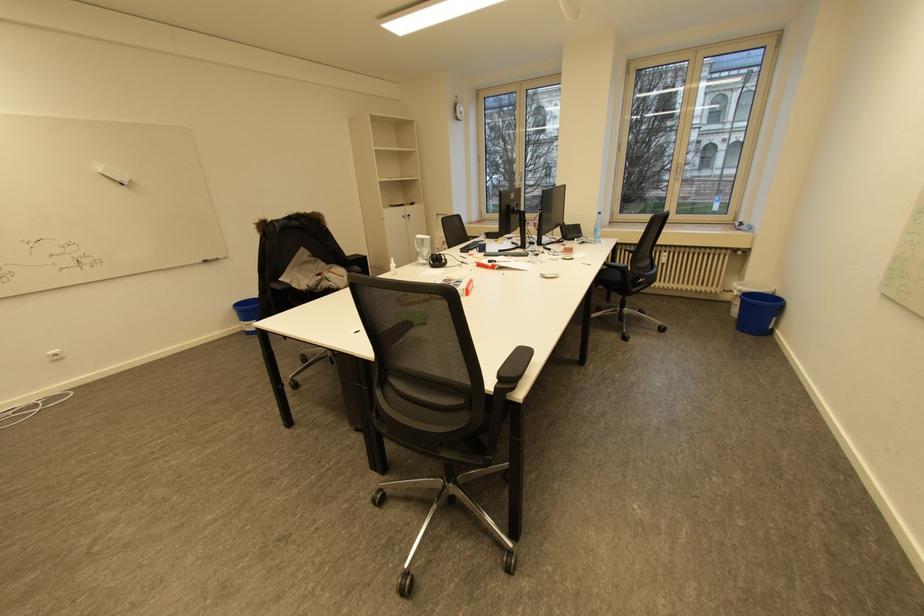
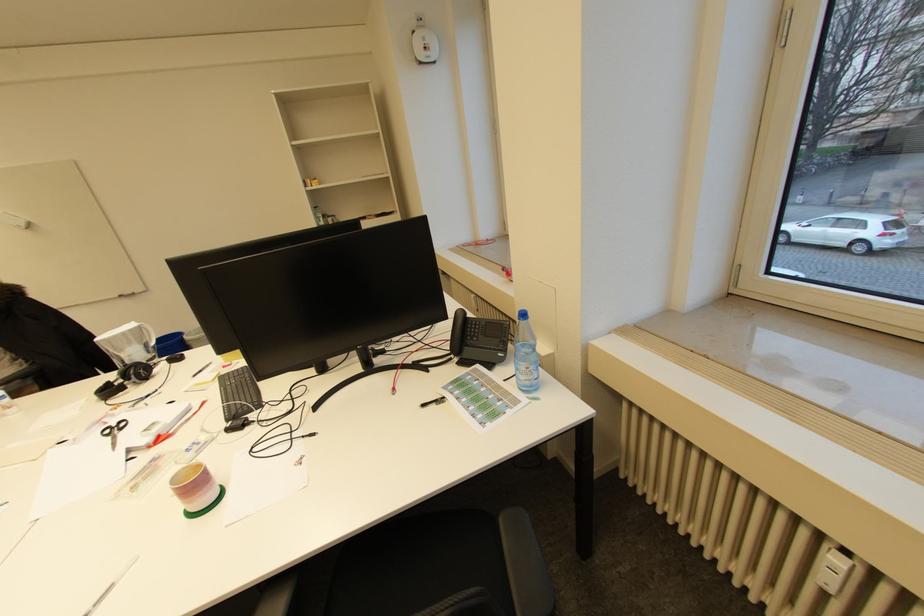
Where in the second image is the point corresponding to pixel 670 261 from the first image?

(833, 580)